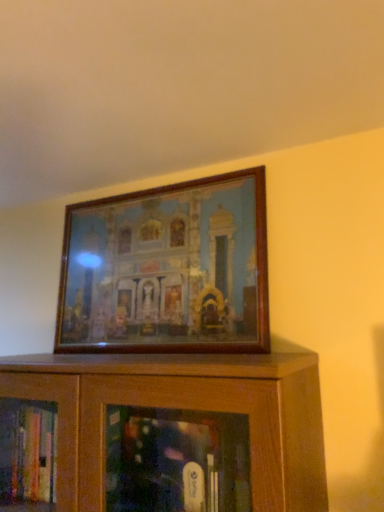
Find the location of a particular element. free space above wooden picture frame at upper center (from a real-world perspective) is located at coordinates pos(160,186).